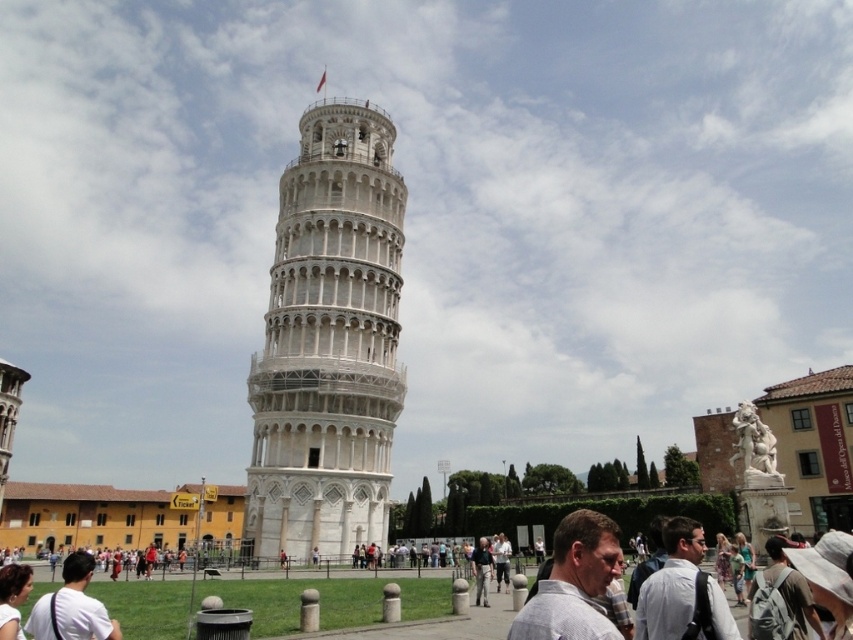
Identify the location of light brown backpack at center. This screenshot has height=640, width=853. (671, 582).

Is light brown backpack at center below white cotton shirt at lower right?

No, light brown backpack at center is not below white cotton shirt at lower right.

Is point (685, 576) positioned before point (751, 572)?

Yes, it is in front of point (751, 572).

You are a GUI agent. You are given a task and a screenshot of the screen. Output one action in this format:
    pyautogui.click(x=<x>, y=<y>)
    Task: Click on the light brown backpack at center
    Image resolution: width=853 pixels, height=640 pixels.
    Given the screenshot: What is the action you would take?
    pyautogui.click(x=671, y=582)

Who is higher up, light brown backpack at lower right or brown hair at lower left?

Positioned higher is brown hair at lower left.

Between point (751, 596) and point (7, 625), which one is positioned behind?

Point (751, 596)

Who is more distant from viewer, (801,596) or (15,566)?

The point (15,566) is more distant.

You are a GUI agent. You are given a task and a screenshot of the screen. Output one action in this format:
    pyautogui.click(x=<x>, y=<y>)
    Task: Click on the light brown backpack at lower right
    This screenshot has width=853, height=640.
    Given the screenshot: What is the action you would take?
    pyautogui.click(x=790, y=589)

Is dark blue jeans at center further to the viewer compared to floral dress at center?

No, dark blue jeans at center is in front of floral dress at center.

Is point (485, 556) closer to viewer compared to point (721, 579)?

No, (485, 556) is further to viewer.

Which is in front, point (473, 554) or point (724, 563)?

Point (724, 563) is more forward.

This screenshot has width=853, height=640. Identify the location of dark blue jeans at center. (480, 570).